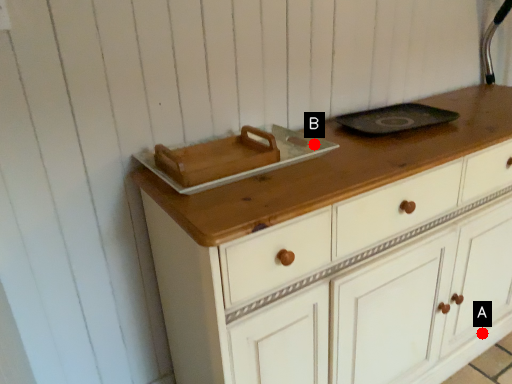
Question: Two points are circled on the image, labeled by A and B beside each circle. Which of the following is the farthest from the observer?

Choices:
 (A) A is further
 (B) B is further

Answer: (A)